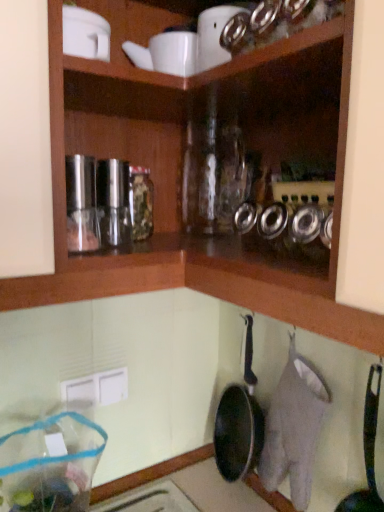
What do you see at coordinates (50, 464) in the screenshot? I see `clear plastic bag at lower left` at bounding box center [50, 464].

The height and width of the screenshot is (512, 384). Identify the location of clear plastic bag at lower left. (50, 464).

This screenshot has width=384, height=512. What do you see at coordinates (367, 453) in the screenshot?
I see `black non-stick frying pan at lower right` at bounding box center [367, 453].

At what (x,y) coordinates should I click in order to perform the action: click on black non-stick frying pan at lower right. Please return your answer as a coordinate pair (x, y). Looking at the image, I should click on (367, 453).

The height and width of the screenshot is (512, 384). I want to click on clear plastic bag at lower left, so click(x=50, y=464).

Considering the positions of objects black non-stick frying pan at lower right and clear plastic bag at lower left in the image provided, who is more to the left, black non-stick frying pan at lower right or clear plastic bag at lower left?

From the viewer's perspective, clear plastic bag at lower left appears more on the left side.

Between black non-stick frying pan at lower right and clear plastic bag at lower left, which one is positioned behind?

clear plastic bag at lower left is more distant.

Which is behind, point (363, 498) or point (33, 494)?

Positioned behind is point (33, 494).

From the image's perspective, relative to clear plastic bag at lower left, is black non-stick frying pan at lower right above or below?

From the image's perspective, black non-stick frying pan at lower right appears above clear plastic bag at lower left.

From a real-world perspective, which object rests below the other?

From a 3D spatial view, clear plastic bag at lower left is below.

Looking at their sizes, would you say black non-stick frying pan at lower right is wider or thinner than clear plastic bag at lower left?

Clearly, black non-stick frying pan at lower right has less width compared to clear plastic bag at lower left.

Considering the sizes of black non-stick frying pan at lower right and clear plastic bag at lower left in the image, is black non-stick frying pan at lower right taller or shorter than clear plastic bag at lower left?

In the image, black non-stick frying pan at lower right appears to be taller than clear plastic bag at lower left.

Based on the photo, can you confirm if black non-stick frying pan at lower right is smaller than clear plastic bag at lower left?

Yes, black non-stick frying pan at lower right is smaller than clear plastic bag at lower left.

Would you say black non-stick frying pan at lower right is outside clear plastic bag at lower left?

Yes, black non-stick frying pan at lower right is not within clear plastic bag at lower left.

Is black non-stick frying pan at lower right not close to clear plastic bag at lower left?

No, there isn't a large distance between black non-stick frying pan at lower right and clear plastic bag at lower left.

Is clear plastic bag at lower left at the back of black non-stick frying pan at lower right?

No, black non-stick frying pan at lower right's orientation is not away from clear plastic bag at lower left.

How many degrees apart are the facing directions of black non-stick frying pan at lower right and clear plastic bag at lower left?

They differ by 87.9 degrees in their facing directions.

At what (x,y) coordinates should I click in order to perform the action: click on frying pan located in front of the clear plastic bag at lower left. Please return your answer as a coordinate pair (x, y). Looking at the image, I should click on (367, 453).

Considering the relative positions of clear plastic bag at lower left and black non-stick frying pan at lower right in the image provided, is clear plastic bag at lower left to the left of black non-stick frying pan at lower right from the viewer's perspective?

Yes, clear plastic bag at lower left is to the left of black non-stick frying pan at lower right.

Considering the relative positions of clear plastic bag at lower left and black non-stick frying pan at lower right in the image provided, is clear plastic bag at lower left behind black non-stick frying pan at lower right?

Yes, it is behind black non-stick frying pan at lower right.

Considering the points (71, 455) and (369, 461), which point is behind, point (71, 455) or point (369, 461)?

The point (71, 455) is behind.

From the image's perspective, does clear plastic bag at lower left appear higher than black non-stick frying pan at lower right?

No, from the image's perspective, clear plastic bag at lower left is not on top of black non-stick frying pan at lower right.

Consider the image. From a real-world perspective, is clear plastic bag at lower left physically below black non-stick frying pan at lower right?

Indeed, from a real-world perspective, clear plastic bag at lower left is positioned beneath black non-stick frying pan at lower right.

Is clear plastic bag at lower left wider or thinner than black non-stick frying pan at lower right?

Considering their sizes, clear plastic bag at lower left looks broader than black non-stick frying pan at lower right.

Is clear plastic bag at lower left taller or shorter than black non-stick frying pan at lower right?

clear plastic bag at lower left is shorter than black non-stick frying pan at lower right.

Looking at this image, considering the sizes of objects clear plastic bag at lower left and black non-stick frying pan at lower right in the image provided, who is bigger, clear plastic bag at lower left or black non-stick frying pan at lower right?

Bigger between the two is clear plastic bag at lower left.

Is black non-stick frying pan at lower right inside clear plastic bag at lower left?

Actually, black non-stick frying pan at lower right is outside clear plastic bag at lower left.

Is clear plastic bag at lower left next to black non-stick frying pan at lower right?

clear plastic bag at lower left is not next to black non-stick frying pan at lower right, and they're not touching.

Is clear plastic bag at lower left oriented away from black non-stick frying pan at lower right?

clear plastic bag at lower left does not have its back to black non-stick frying pan at lower right.

What's the angular difference between clear plastic bag at lower left and black non-stick frying pan at lower right's facing directions?

The angle between the facing direction of clear plastic bag at lower left and the facing direction of black non-stick frying pan at lower right is 87.9 degrees.

Image resolution: width=384 pixels, height=512 pixels. Identify the location of frying pan located in front of the clear plastic bag at lower left. (367, 453).

I want to click on glass jar located below the black non-stick frying pan at lower right (from the image's perspective), so point(50,464).

The width and height of the screenshot is (384, 512). In order to click on glass jar that is under the black non-stick frying pan at lower right (from a real-world perspective) in this screenshot , I will do `click(50, 464)`.